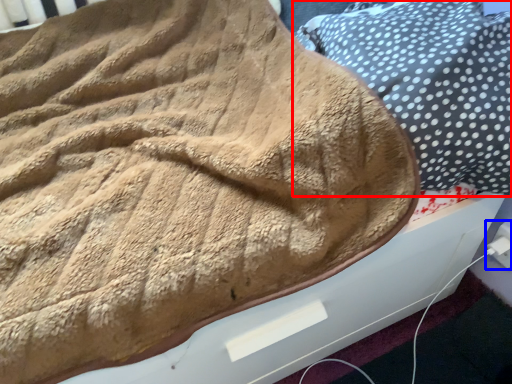
Question: Which of the following is the closest to the observer, pillow (highlighted by a red box) or electric outlet (highlighted by a blue box)?

Choices:
 (A) pillow
 (B) electric outlet

Answer: (A)